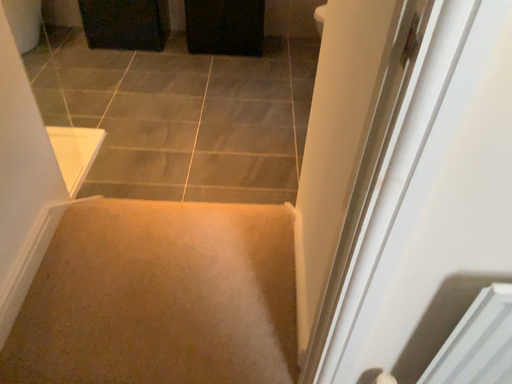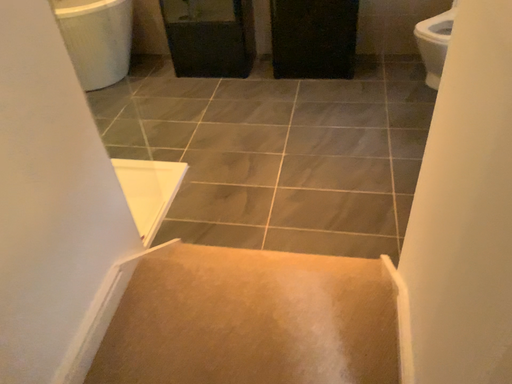
Question: How did the camera likely rotate when shooting the video?

Choices:
 (A) rotated right
 (B) rotated left

Answer: (B)